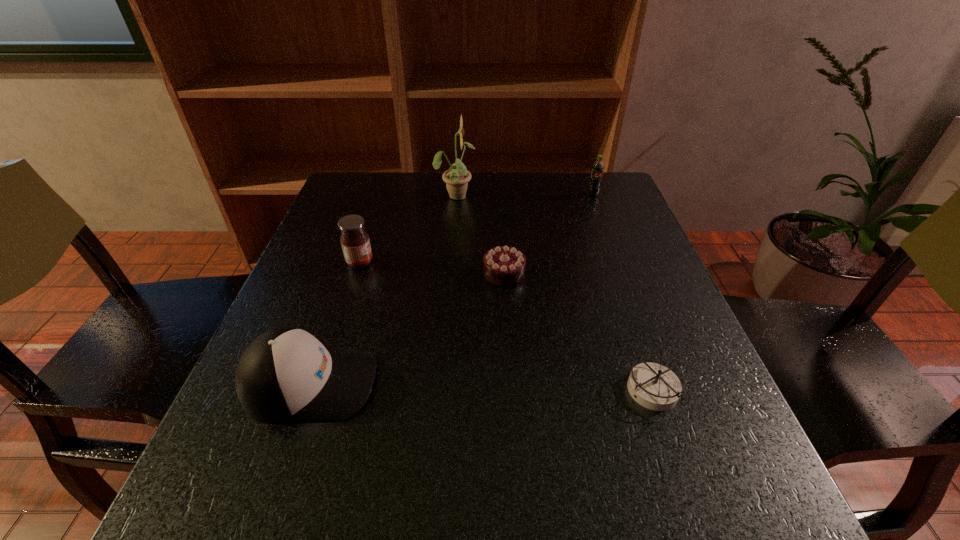
In order to click on vacant region located 0.320m on the front panel of the cap in this screenshot , I will do `click(563, 383)`.

The image size is (960, 540). I want to click on free space located on the left of the compass, so click(x=580, y=391).

Identify the location of free space located on the left of the chocolate cake. (393, 273).

Locate an element on the screen. The image size is (960, 540). sunflower located at the far edge is located at coordinates (x=457, y=177).

Locate an element on the screen. Image resolution: width=960 pixels, height=540 pixels. soda present at the far edge is located at coordinates [x=597, y=169].

Find the location of a particular element. The height and width of the screenshot is (540, 960). jam positioned at the left edge is located at coordinates (355, 242).

Find the location of `cap that is at the left edge`. cap that is at the left edge is located at coordinates click(286, 374).

Find the location of a particular element. The image size is (960, 540). soda positioned at the right edge is located at coordinates (597, 169).

Find the location of a particular element. The width and height of the screenshot is (960, 540). compass located at the right edge is located at coordinates (654, 386).

You are a GUI agent. You are given a task and a screenshot of the screen. Output one action in this format:
    pyautogui.click(x=<x>, y=<y>)
    Task: Click on the object positioned at the far right corner
    The image size is (960, 540).
    Given the screenshot: What is the action you would take?
    pyautogui.click(x=597, y=169)